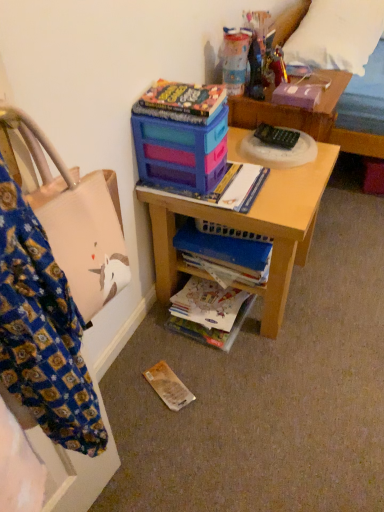
Identify the location of empty space that is to the right of matte paper book at lower center, which is the 2th book from top to bottom. This screenshot has height=512, width=384. (279, 327).